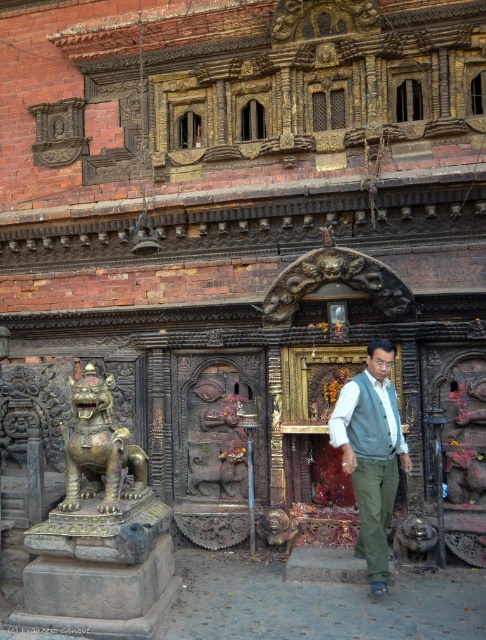
Question: Is light blue fabric vest at center positioned before gold polished lion at left?

Choices:
 (A) yes
 (B) no

Answer: (B)

Question: Which of the following is the farthest from the observer?

Choices:
 (A) pyautogui.click(x=340, y=433)
 (B) pyautogui.click(x=341, y=419)

Answer: (B)

Question: Which object is closer to the camera taking this photo?

Choices:
 (A) light blue fabric vest at center
 (B) white matte shirt at center

Answer: (A)

Question: Which point is closer to the camera?

Choices:
 (A) (396, 442)
 (B) (361, 467)

Answer: (B)

Question: Can you confirm if gold polished lion at left is thinner than white matte shirt at center?

Choices:
 (A) no
 (B) yes

Answer: (B)

Question: Can you confirm if light blue fabric vest at center is positioned to the right of white matte shirt at center?

Choices:
 (A) no
 (B) yes

Answer: (B)